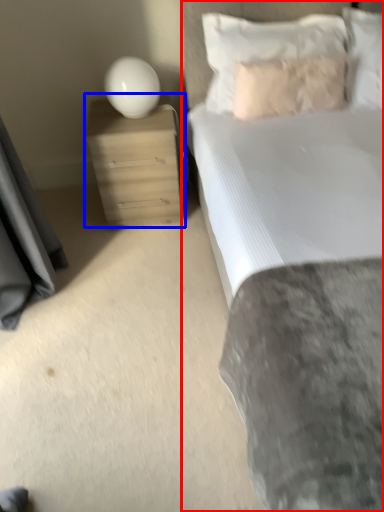
Question: Which of the following is the closest to the observer, bed (highlighted by a red box) or nightstand (highlighted by a blue box)?

Choices:
 (A) bed
 (B) nightstand

Answer: (A)